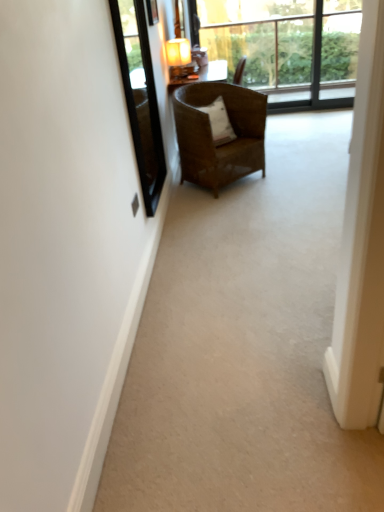
Question: Is white soft pillow at center taller or shorter than transparent glass window at upper center?

Choices:
 (A) short
 (B) tall

Answer: (A)

Question: From the image's perspective, is white soft pillow at center positioned above or below transparent glass window at upper center?

Choices:
 (A) below
 (B) above

Answer: (A)

Question: Which object is positioned closest to the transparent glass window at upper center?

Choices:
 (A) white soft pillow at center
 (B) brown woven chair at center
 (C) matte brown lamp at upper center
 (D) transparent glass window screen at upper left
 (E) white glossy screen door at right

Answer: (C)

Question: Which is farther from the matte brown lamp at upper center?

Choices:
 (A) transparent glass window at upper center
 (B) white soft pillow at center
 (C) transparent glass window screen at upper left
 (D) brown woven chair at center
 (E) white glossy screen door at right

Answer: (E)